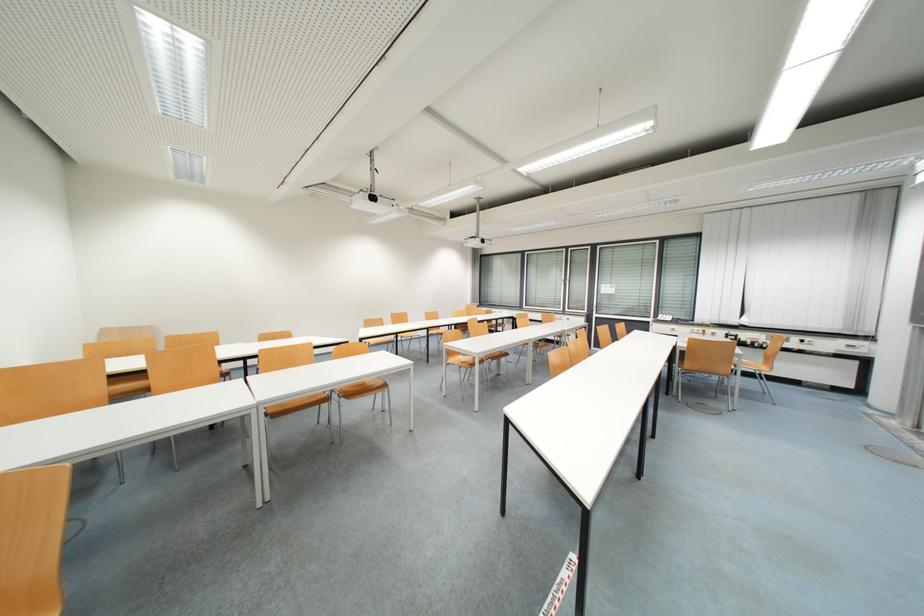
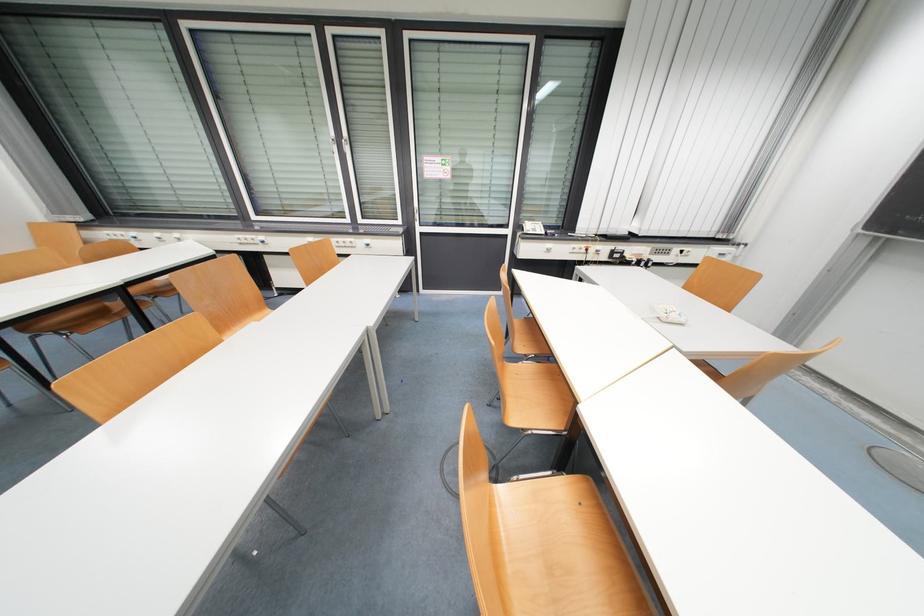
Where in the second image is the point corresponding to pixel 706 331 from the first image?

(589, 246)